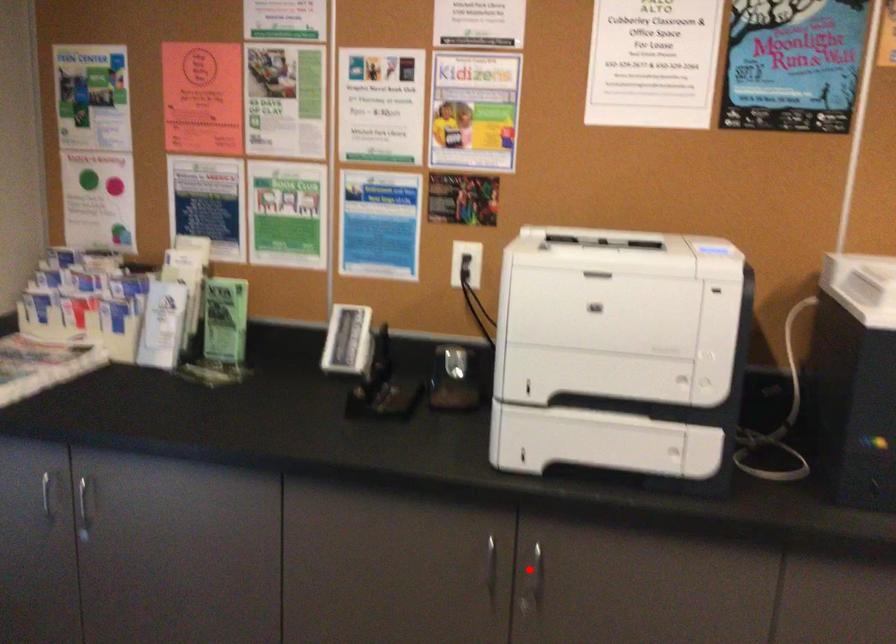
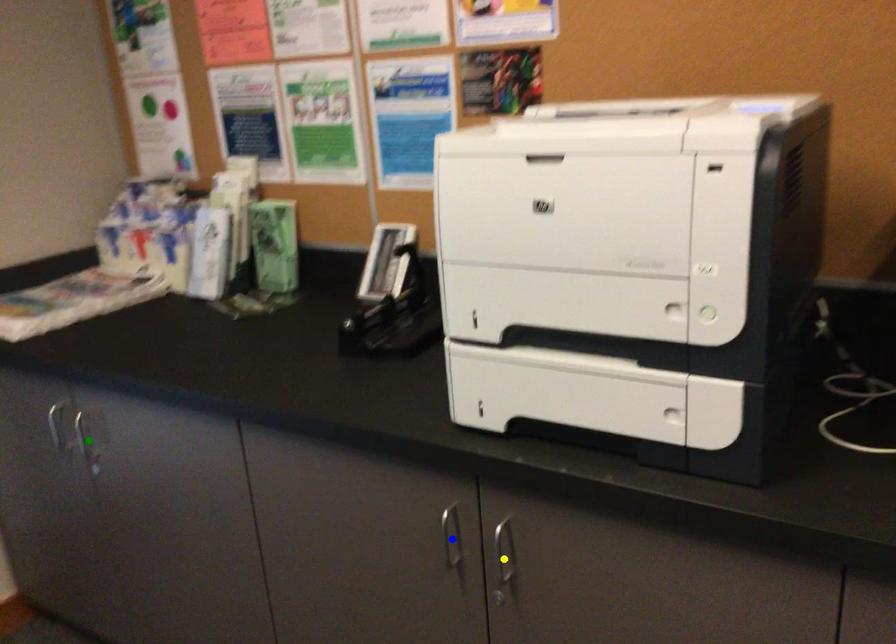
Question: I am providing you with two images of the same scene from different viewpoints. A red point is marked on the first image. You are given multiple points on the second image. Which point in image 2 represents the same 3d spot as the red point in image 1?

Choices:
 (A) blue point
 (B) yellow point
 (C) green point

Answer: (B)